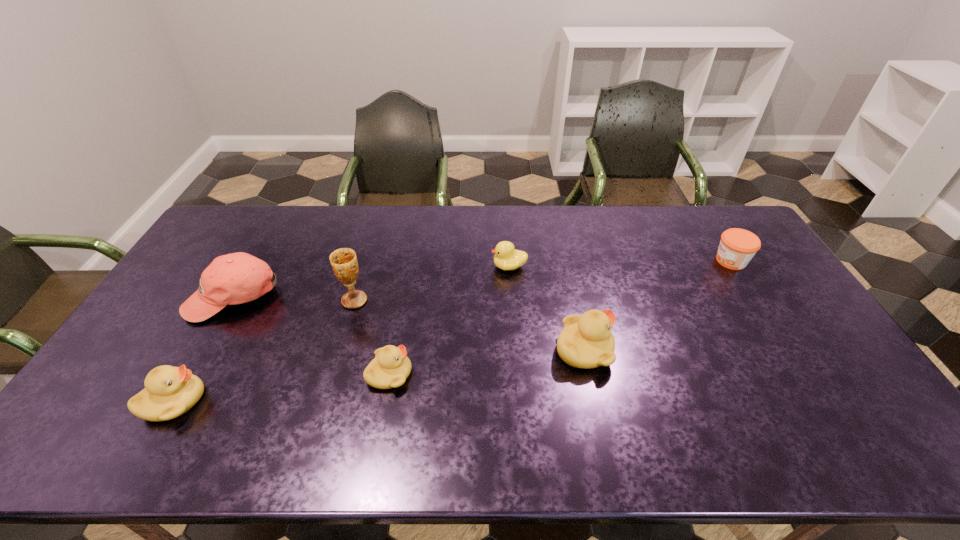
This screenshot has width=960, height=540. I want to click on vacant space at the near left corner, so click(95, 414).

Locate an element on the screen. Image resolution: width=960 pixels, height=540 pixels. free point between the baseball cap and the fourth tallest object is located at coordinates (204, 349).

Where is `free spot between the chalice and the leftmost duckling`? This screenshot has width=960, height=540. free spot between the chalice and the leftmost duckling is located at coordinates 264,351.

Where is `free space between the leftmost duckling and the jam`? The width and height of the screenshot is (960, 540). free space between the leftmost duckling and the jam is located at coordinates (452, 331).

This screenshot has height=540, width=960. Identify the location of free spot between the baseball cap and the leftmost duckling. (204, 349).

Locate an element on the screen. The image size is (960, 540). vacant area between the rightmost object and the leftmost duckling is located at coordinates (452, 331).

Locate an element on the screen. The height and width of the screenshot is (540, 960). free space between the fifth object from left to right and the baseball cap is located at coordinates (372, 281).

At what (x,y) coordinates should I click in order to perform the action: click on free space between the baseball cap and the jam. Please return your answer as a coordinate pair (x, y). The width and height of the screenshot is (960, 540). Looking at the image, I should click on (482, 279).

The image size is (960, 540). I want to click on blank region between the rightmost duckling and the baseball cap, so click(x=409, y=323).

The height and width of the screenshot is (540, 960). I want to click on free space between the fourth shortest object and the jam, so click(x=452, y=331).